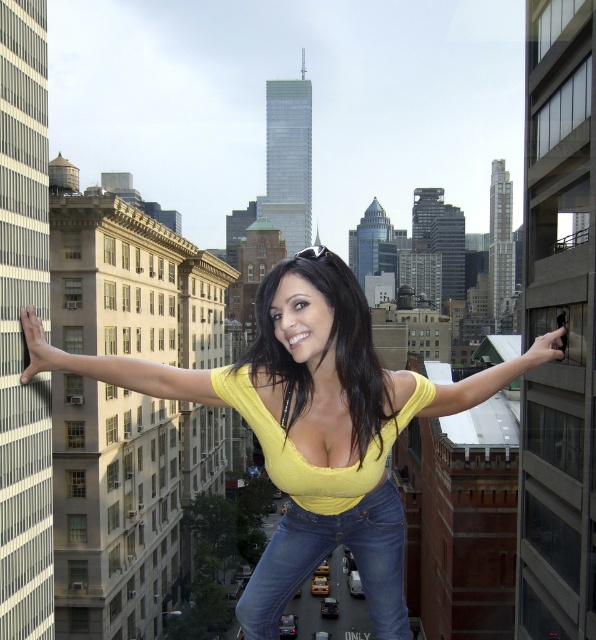
Question: Which object appears closest to the camera in this image?

Choices:
 (A) yellow matte top at center
 (B) jeans at center

Answer: (A)

Question: Which object is farther from the camera taking this photo?

Choices:
 (A) yellow matte top at center
 (B) jeans at center

Answer: (B)

Question: Which point is farther from the camera taking this photo?

Choices:
 (A) (319, 356)
 (B) (393, 634)

Answer: (B)

Question: Can you confirm if yellow matte top at center is positioned above jeans at center?

Choices:
 (A) no
 (B) yes

Answer: (B)

Question: Is yellow matte top at center positioned at the back of jeans at center?

Choices:
 (A) yes
 (B) no

Answer: (B)

Question: Does yellow matte top at center appear over jeans at center?

Choices:
 (A) no
 (B) yes

Answer: (B)